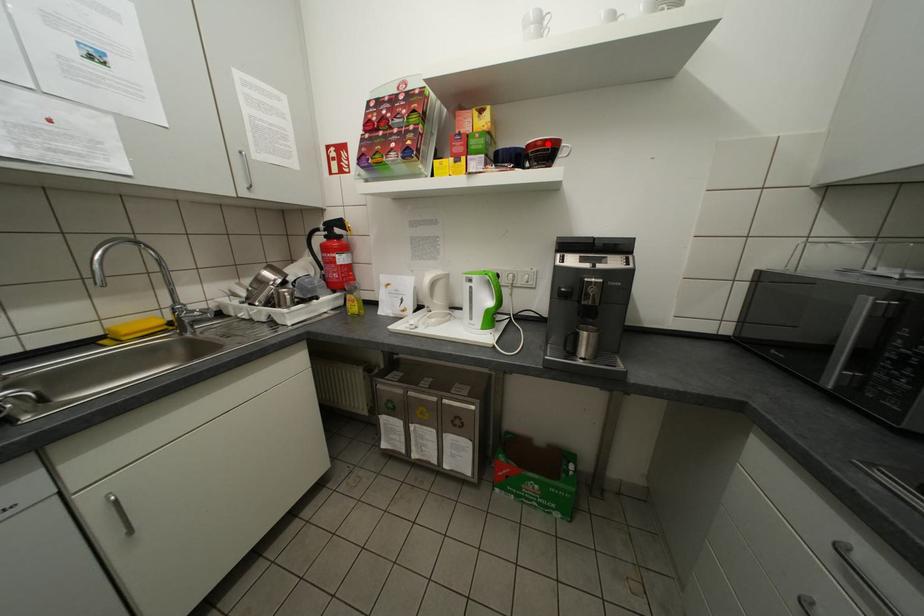
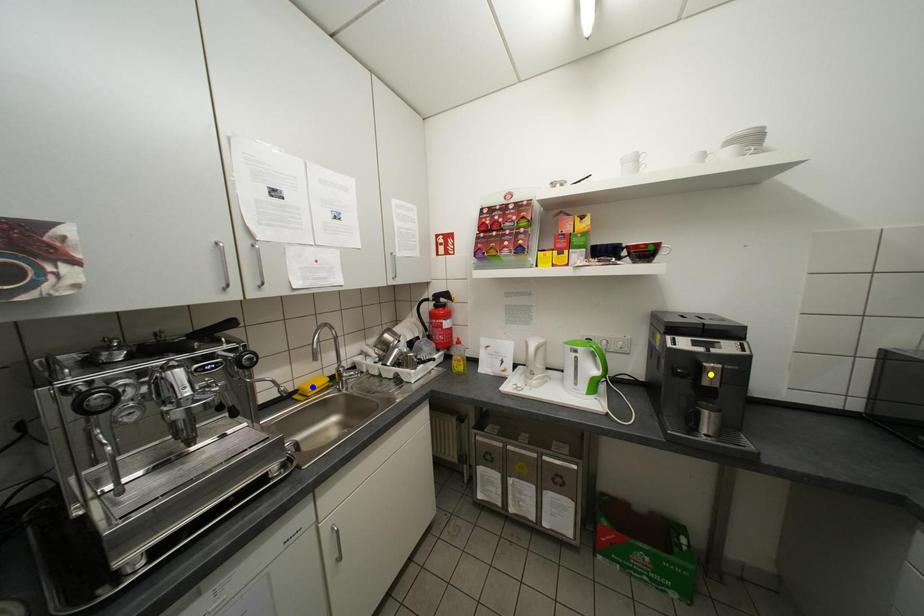
Question: I am providing you with two images of the same scene from different viewpoints. A red point is marked on the first image. You are given multiple points on the second image. Which mark in image 2 goes with the point in image 1?

Choices:
 (A) yellow point
 (B) green point
 (C) blue point

Answer: (B)